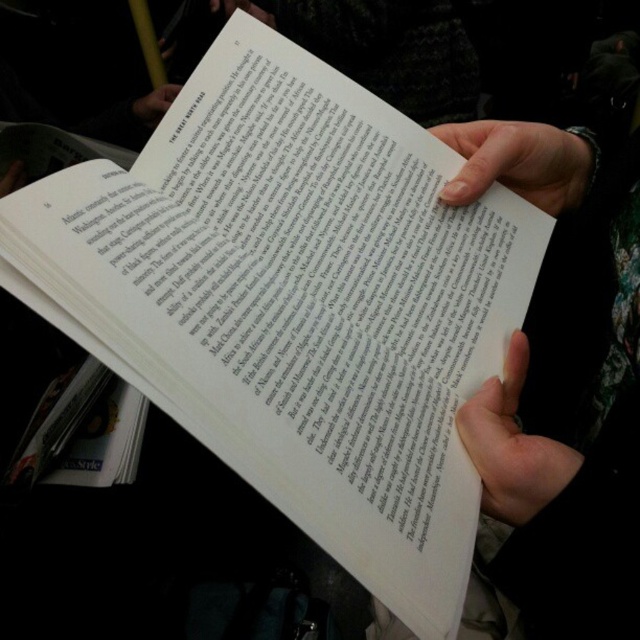
Is white paper book at lower left to the right of matte white paper at upper center from the viewer's perspective?

Yes, white paper book at lower left is to the right of matte white paper at upper center.

Who is shorter, white paper book at lower left or matte white paper at upper center?

matte white paper at upper center

Identify the location of white paper book at lower left. (81, 433).

Which is more to the left, white paper book at lower left or smooth skin hand at upper right?

white paper book at lower left is more to the left.

Is white paper book at lower left behind smooth skin hand at upper right?

Yes, white paper book at lower left is further from the viewer.

Locate an element on the screen. Image resolution: width=640 pixels, height=640 pixels. white paper book at lower left is located at coordinates (81, 433).

You are a GUI agent. You are given a task and a screenshot of the screen. Output one action in this format:
    pyautogui.click(x=<x>, y=<y>)
    Task: Click on the white paper book at lower left
    
    Given the screenshot: What is the action you would take?
    pyautogui.click(x=81, y=433)

Does point (83, 406) lie behind point (188, 99)?

Yes, it is.

Who is more forward, (x=88, y=403) or (x=202, y=99)?

Positioned in front is point (x=202, y=99).

The height and width of the screenshot is (640, 640). I want to click on white paper book at lower left, so click(x=81, y=433).